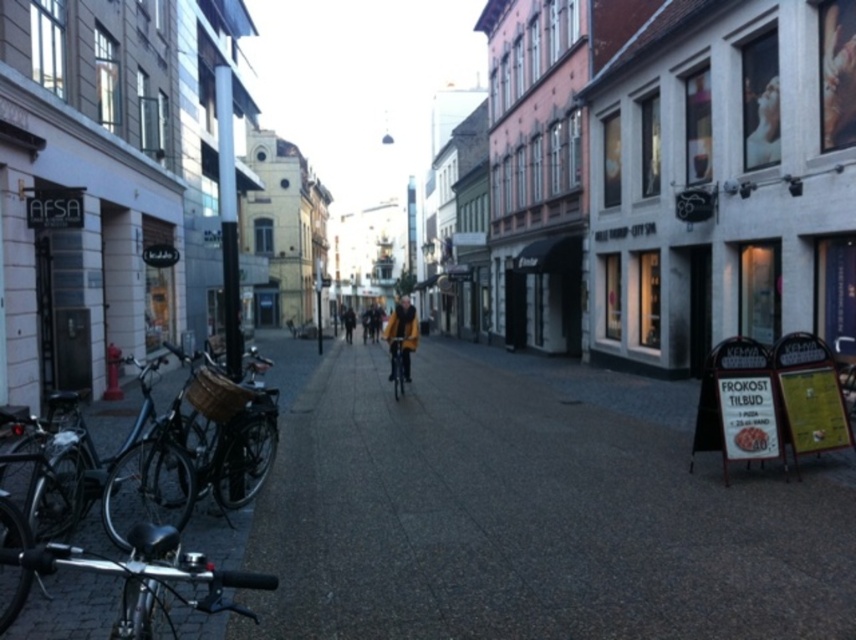
You are a delivery person standing at the entrance of the AFSA building on the left side of the street. You need to place a package on the smooth concrete pavement at center. Can you directly walk straight ahead from your current position to reach it without needing to turn?

The smooth concrete pavement at center is located at point (x=533, y=513), so yes, you can walk straight ahead from your current position at the entrance of the AFSA building on the left side to reach it without needing to turn.